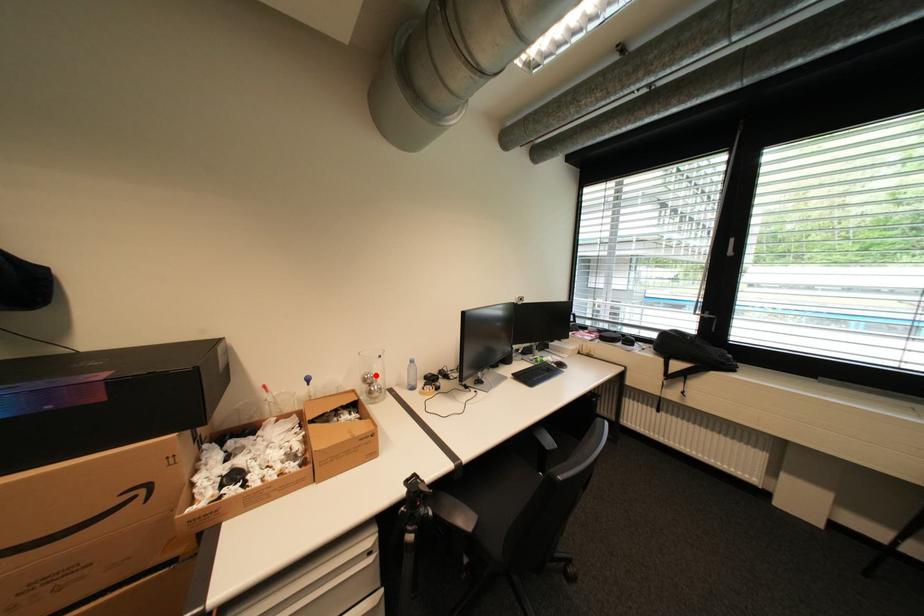
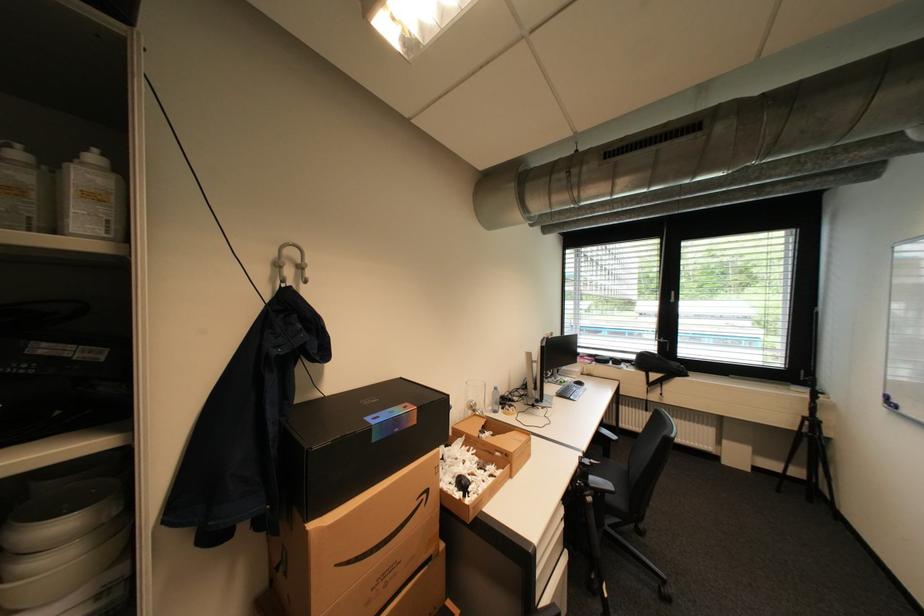
In the second image, find the point that corresponds to the highlighted location in the first image.

(480, 402)